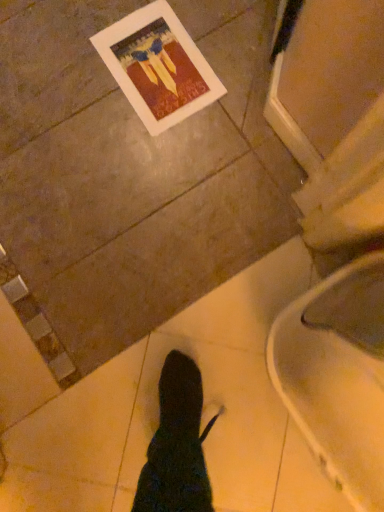
Question: From a real-world perspective, relative to white glossy toilet at lower right, is matte paper postcard at upper left vertically above or below?

Choices:
 (A) above
 (B) below

Answer: (B)

Question: Is matte paper postcard at upper left in front of or behind white glossy toilet at lower right in the image?

Choices:
 (A) behind
 (B) front

Answer: (A)

Question: In terms of width, does matte paper postcard at upper left look wider or thinner when compared to white glossy toilet at lower right?

Choices:
 (A) thin
 (B) wide

Answer: (A)

Question: From a real-world perspective, is white glossy toilet at lower right positioned above or below matte paper postcard at upper left?

Choices:
 (A) below
 (B) above

Answer: (B)

Question: Is white glossy toilet at lower right in front of or behind matte paper postcard at upper left in the image?

Choices:
 (A) behind
 (B) front

Answer: (B)

Question: Looking at the image, does white glossy toilet at lower right seem bigger or smaller compared to matte paper postcard at upper left?

Choices:
 (A) big
 (B) small

Answer: (A)

Question: Is white glossy toilet at lower right spatially inside matte paper postcard at upper left, or outside of it?

Choices:
 (A) inside
 (B) outside

Answer: (B)